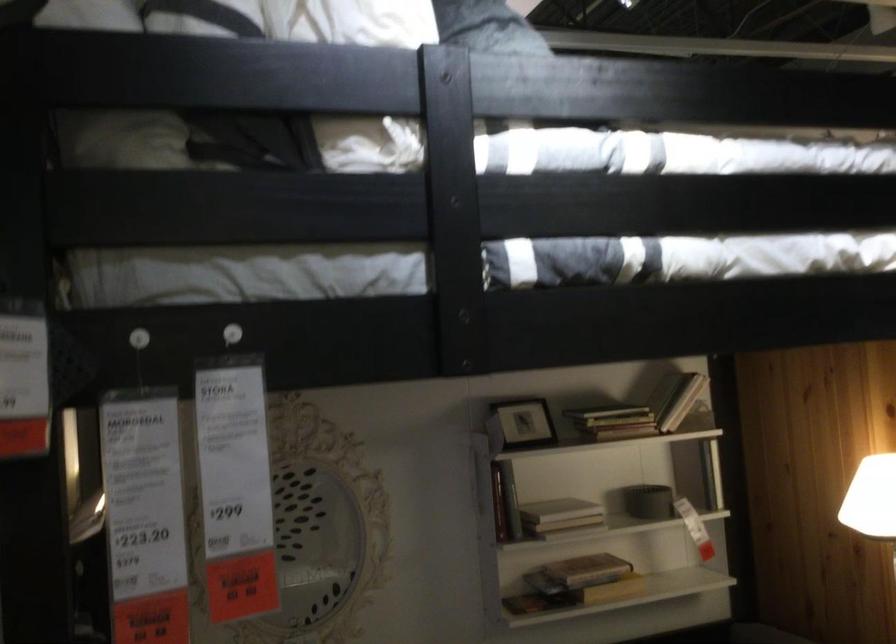
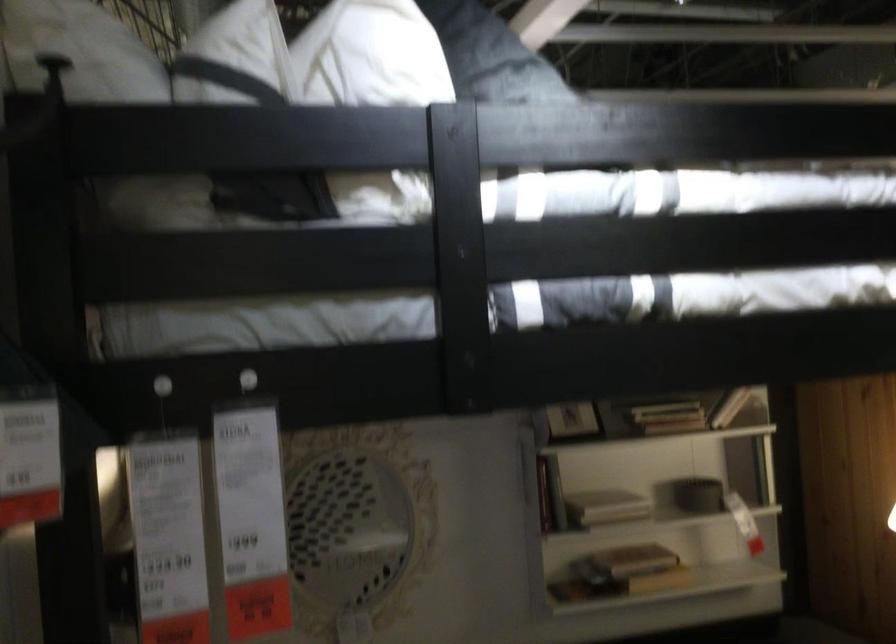
The images are taken continuously from a first-person perspective. In which direction are you moving?

The cameraman walked toward right, backward.